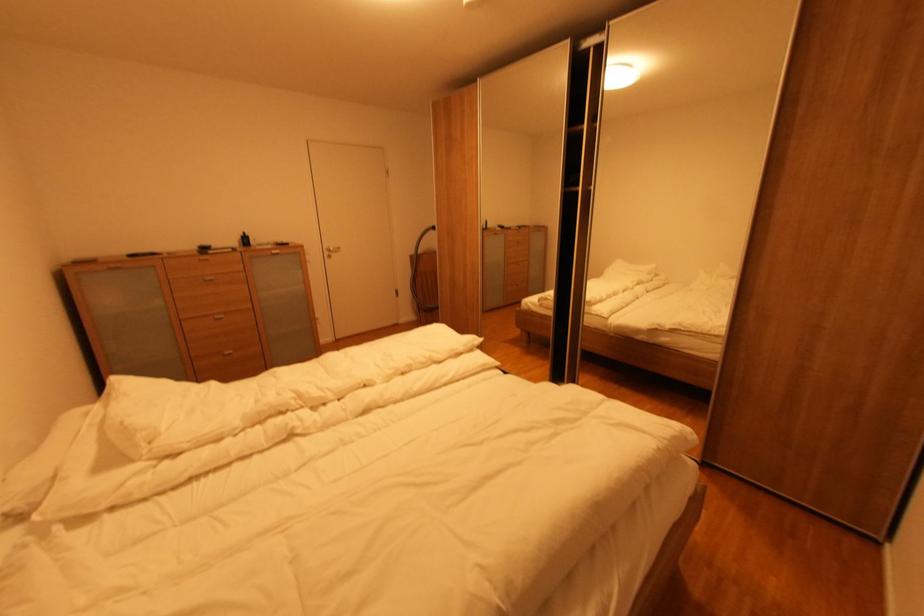
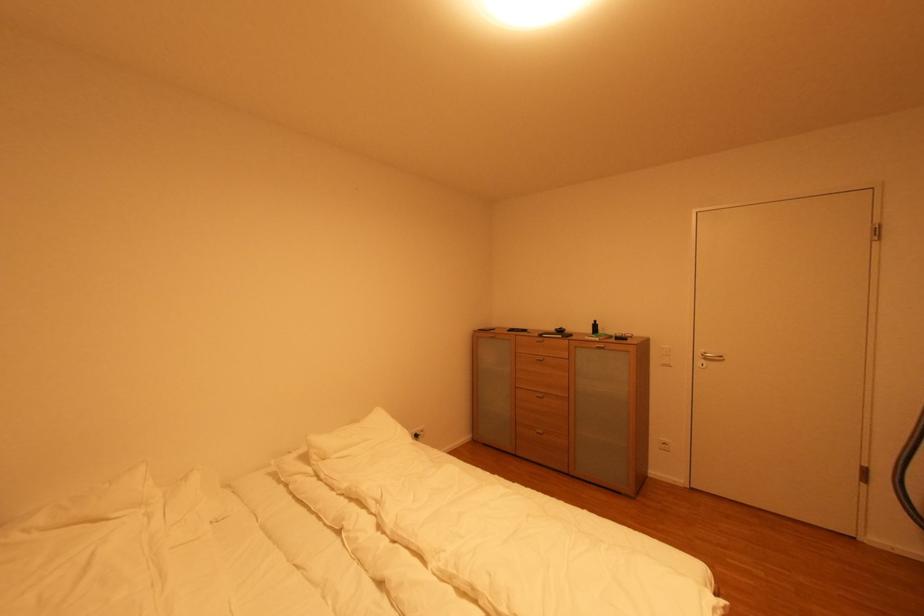
The point at (294, 246) is marked in the first image. Where is the corresponding point in the second image?

(630, 339)